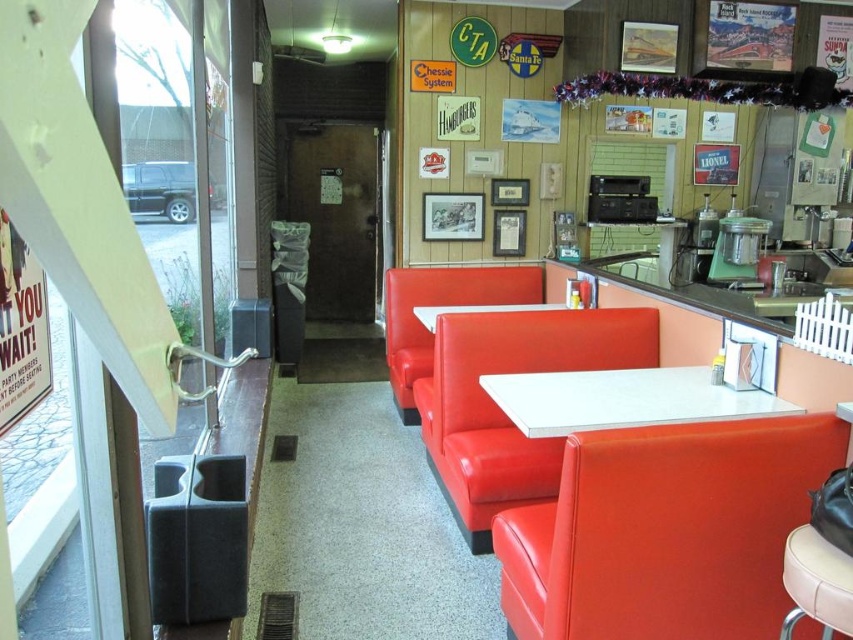
You are a diner patron who just entered the diner and wants to sit at the closest available table or booth. You see the matte red booth at center and the white glossy table at center. Which one should you head towards?

You should head towards the matte red booth at center because it is closer to you than the white glossy table at center, which is further away.

You are a diner patron who wants to sit at the largest available table in the center of the diner. Which object should you choose between the matte red booth at center and the white glossy table at center?

The matte red booth at center is larger in size than the white glossy table at center, so you should choose the matte red booth at center as it is the largest available table in the center of the diner.